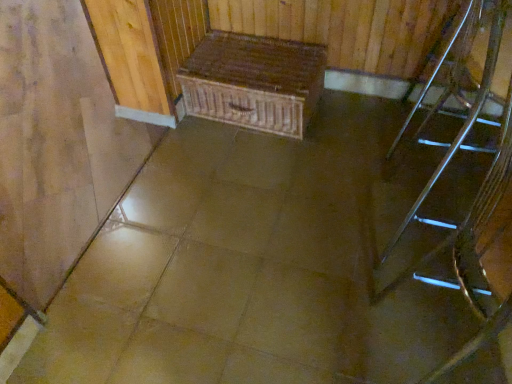
Locate an element on the screen. free region under metallic silver chair at right (from a real-world perspective) is located at coordinates (453, 140).